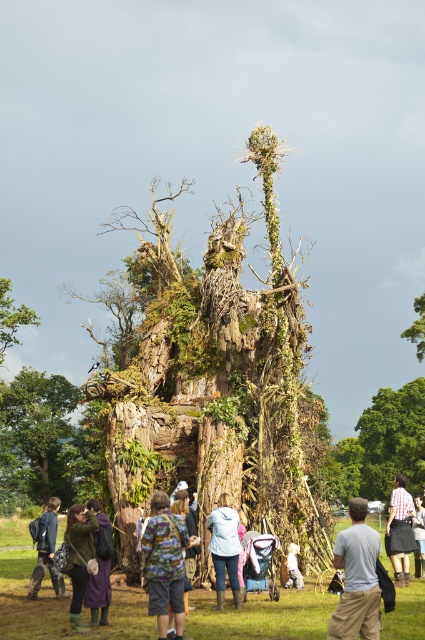
Looking at this image, you are standing at the entrance of the park and want to find the rusty wood sculpture at center. According to the map, your current position is at point A, which is at coordinates 0.3, 0.3. The sculpture is at coordinates 0.592, 0.518. Which direction should you move to reach it?

The rusty wood sculpture at center is located at point (x=220, y=378). Since your current position is at (x=127, y=192), you should move northeast to reach it because the sculpture is both to the east and north of your current location.

You are standing in the park and see two jackets hanging on the tree structure. The light brown leather jacket at center and the light blue denim jacket at center. Which jacket is taller?

The light brown leather jacket at center is much taller than the light blue denim jacket at center.